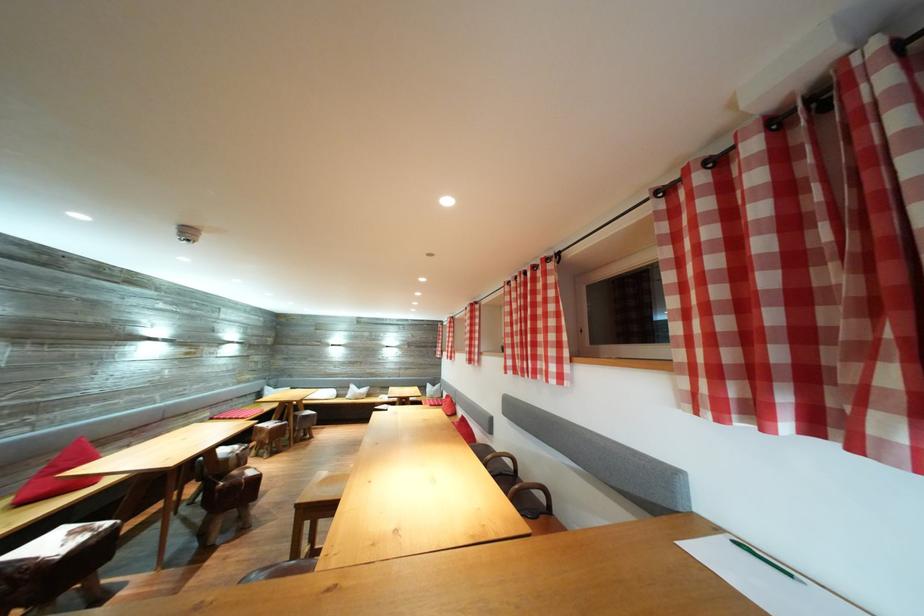
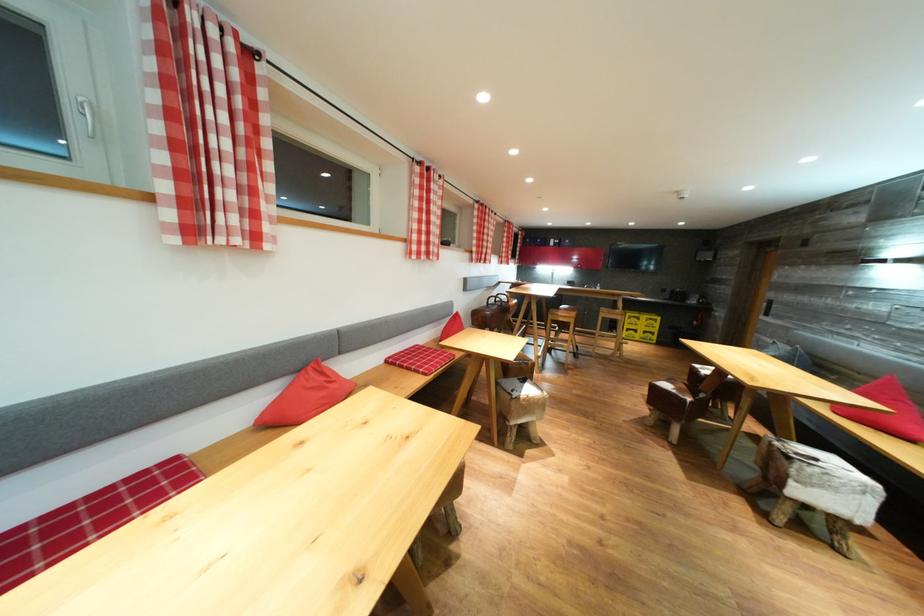
Question: I am providing you with two images of the same scene from different viewpoints. After the viewpoint changes to image2, which objects are now occluded?

Choices:
 (A) green pencil
 (B) chair sitting surface
 (C) red pillow
 (D) roll of masking tape

Answer: (A)